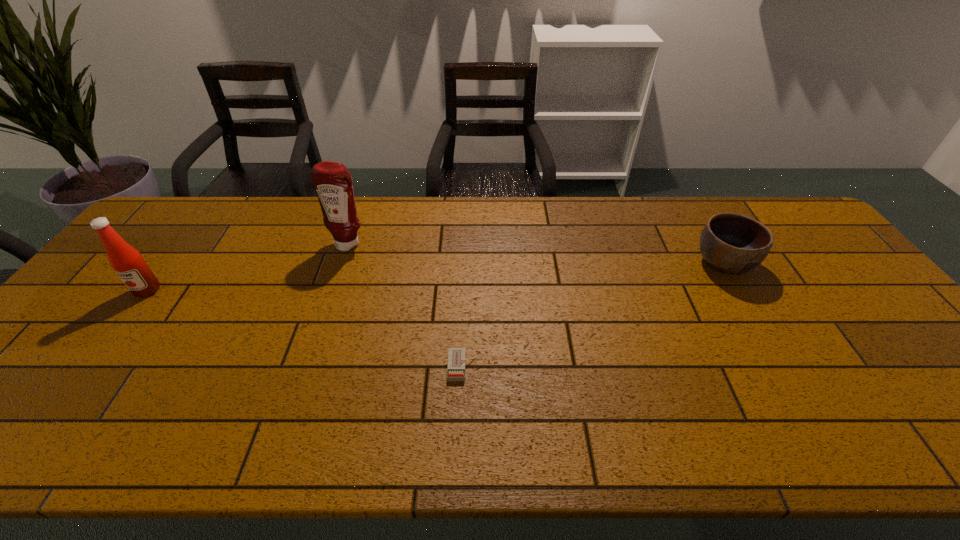
Image resolution: width=960 pixels, height=540 pixels. I want to click on vacant area in the image that satisfies the following two spatial constraints: 1. on the front side of the bowl; 2. on the striking surface of the third object from left to right, so click(x=785, y=367).

Image resolution: width=960 pixels, height=540 pixels. I want to click on free space that satisfies the following two spatial constraints: 1. on the front side of the bowl; 2. on the striking surface of the second object from right to left, so click(x=785, y=367).

This screenshot has width=960, height=540. What are the coordinates of `free location that satisfies the following two spatial constraints: 1. on the front side of the rightmost object; 2. on the striking surface of the matchbox` in the screenshot? It's located at (785, 367).

In order to click on free space that satisfies the following two spatial constraints: 1. on the front side of the bowl; 2. on the right side of the farther condiment in this screenshot , I will do `click(342, 263)`.

Locate an element on the screen. free region that satisfies the following two spatial constraints: 1. on the front side of the third tallest object; 2. on the right side of the farther condiment is located at coordinates (342, 263).